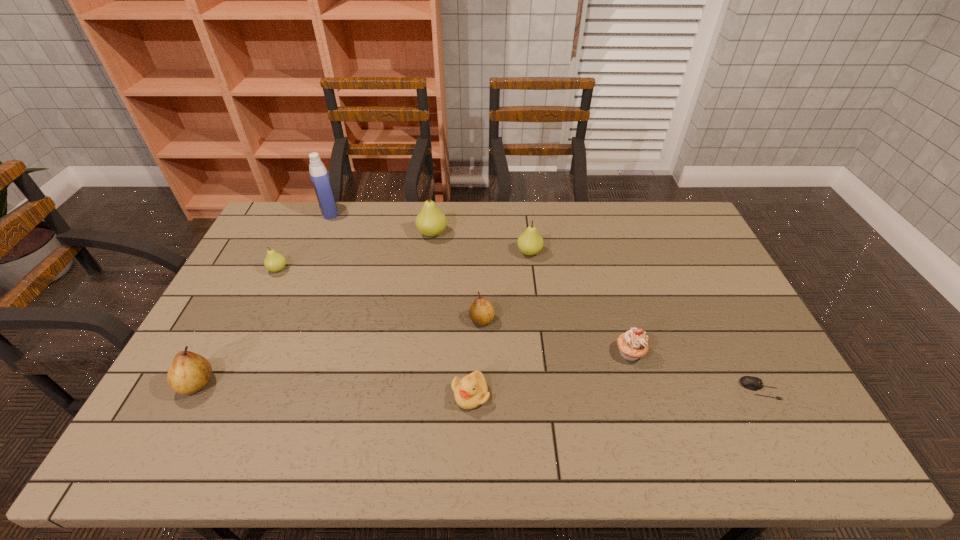
This screenshot has width=960, height=540. Find the location of `unoccupied area between the blue detergent and the nearest pear`. unoccupied area between the blue detergent and the nearest pear is located at coordinates (263, 298).

Where is `vacant area that lies between the second nearest pear and the duckling`? The height and width of the screenshot is (540, 960). vacant area that lies between the second nearest pear and the duckling is located at coordinates (476, 357).

Identify the location of blank region between the second shortest object and the shortest object. The image size is (960, 540). (615, 392).

Find the location of a particular element. This screenshot has height=540, width=960. vacant point located between the third farthest pear and the third farthest object is located at coordinates point(404,261).

The width and height of the screenshot is (960, 540). I want to click on object that stands as the second closest to the left brown pear, so click(471, 391).

The height and width of the screenshot is (540, 960). What are the coordinates of `object identified as the fourth closest to the second shortest object` in the screenshot? It's located at (431, 221).

Locate which pear is the closest to the left brown pear. Please provide its 2D coordinates. Your answer should be formatted as a tuple, i.e. [(x, y)], where the tuple contains the x and y coordinates of a point satisfying the conditions above.

[(274, 262)]

Find the location of a particular element. pear that is the closest to the third farthest object is located at coordinates (481, 312).

In order to click on green pear that is the closest to the sixth nearest object in this screenshot , I will do `click(431, 221)`.

Find the location of a particular element. The height and width of the screenshot is (540, 960). the second closest green pear relative to the sixth farthest object is located at coordinates (431, 221).